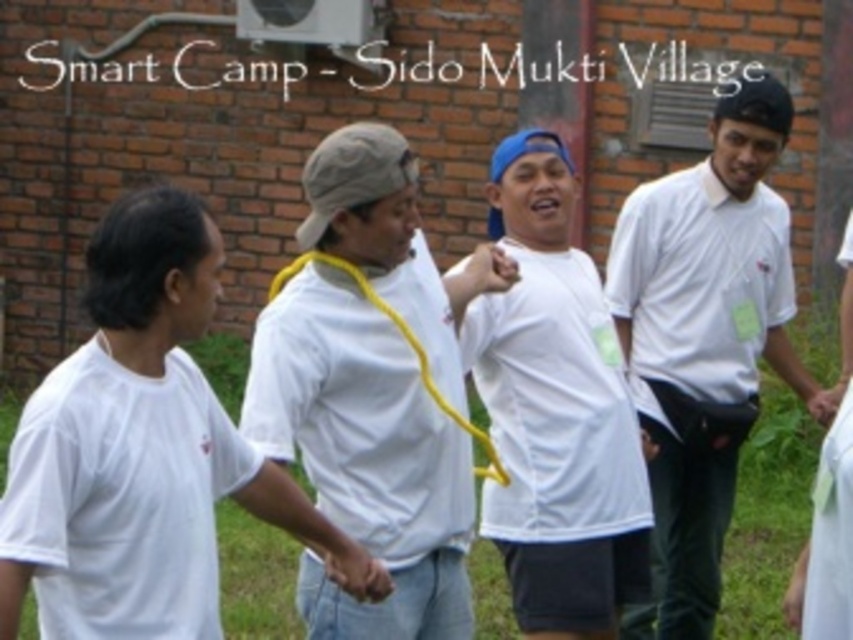
Question: Which point appears farthest from the camera in this image?

Choices:
 (A) (184, 513)
 (B) (375, 182)
 (C) (508, 413)

Answer: (C)

Question: Which object appears farthest from the camera in this image?

Choices:
 (A) white smooth shirt at center
 (B) white matte shirt at left
 (C) white matte t-shirt at center
 (D) white matte shirt at center

Answer: (A)

Question: Can you confirm if white matte shirt at center is thinner than white smooth shirt at center?

Choices:
 (A) yes
 (B) no

Answer: (A)

Question: Does white matte shirt at center appear on the right side of white smooth shirt at center?

Choices:
 (A) no
 (B) yes

Answer: (A)

Question: Among these objects, which one is farthest from the camera?

Choices:
 (A) white matte t-shirt at center
 (B) white matte shirt at center
 (C) white smooth shirt at center
 (D) white matte shirt at left

Answer: (C)

Question: Is white matte shirt at left above white matte t-shirt at center?

Choices:
 (A) no
 (B) yes

Answer: (A)